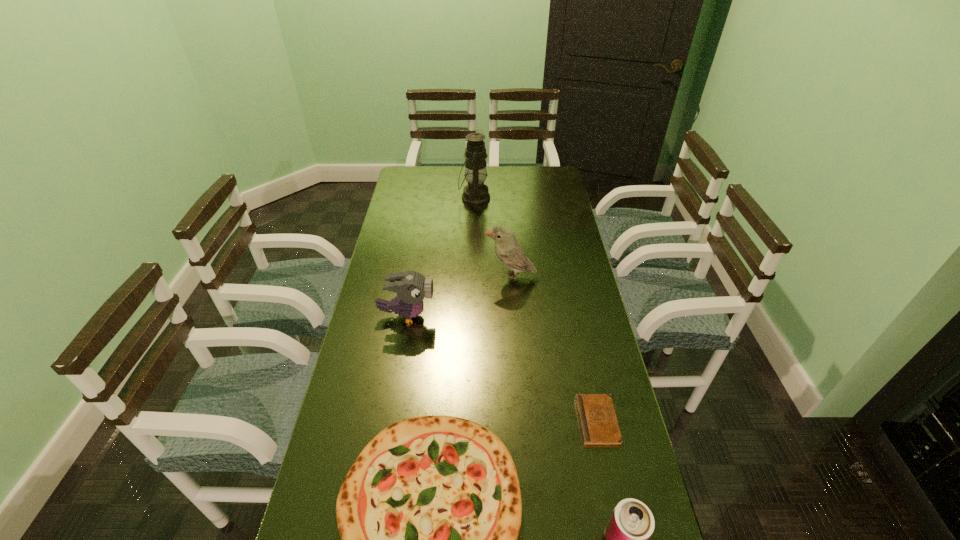
Identify the location of free point located at the face of the right bird. (434, 277).

Locate an element on the screen. The image size is (960, 540). vacant space located at the beak of the left bird is located at coordinates (495, 316).

You are a GUI agent. You are given a task and a screenshot of the screen. Output one action in this format:
    pyautogui.click(x=<x>, y=<y>)
    Task: Click on the vacant position located on the spine side of the shortest object
    The width and height of the screenshot is (960, 540).
    Given the screenshot: What is the action you would take?
    pyautogui.click(x=447, y=420)

Locate an element on the screen. free space located 0.330m on the spine side of the shortest object is located at coordinates (455, 420).

Identify the location of free region located on the spine side of the shortest object. This screenshot has height=540, width=960. (516, 420).

In order to click on object at the far edge in this screenshot , I will do `click(476, 193)`.

You are a GUI agent. You are given a task and a screenshot of the screen. Output one action in this format:
    pyautogui.click(x=<x>, y=<y>)
    Task: Click on the object that is at the left edge
    This screenshot has height=540, width=960.
    Given the screenshot: What is the action you would take?
    pyautogui.click(x=411, y=287)

Where is `object positioned at the right edge`? The height and width of the screenshot is (540, 960). object positioned at the right edge is located at coordinates (598, 422).

Where is `vacant area at the far edge of the desktop`? The height and width of the screenshot is (540, 960). vacant area at the far edge of the desktop is located at coordinates (461, 168).

Identify the location of vacant space at the left edge of the desktop. The width and height of the screenshot is (960, 540). (393, 343).